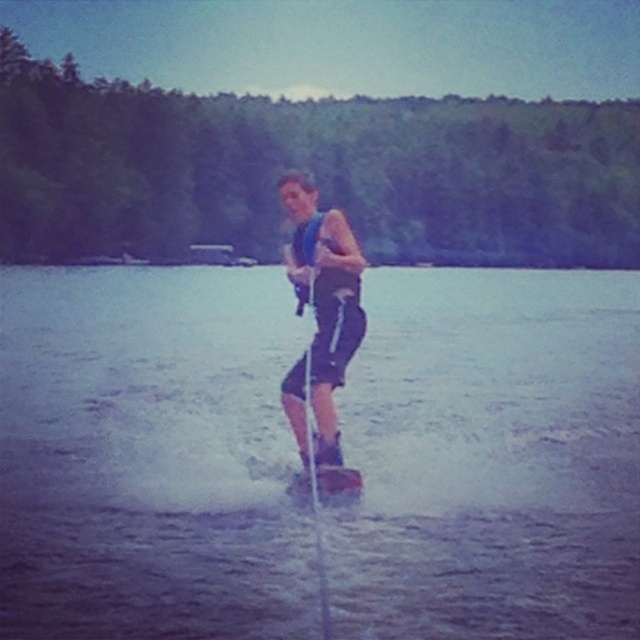
You are a photographer trying to capture the water skier. You notice the clear water at center and the blue fabric life vest at center. Which object is closer to the camera based on their positions?

The clear water at center is closer to the camera because it is positioned in front of the blue fabric life vest at center.

You are a lifeguard observing the scene. You notice the clear water at center and the blue fabric life vest at center. Which object is positioned higher from the ground?

The clear water at center is located above the blue fabric life vest at center, so the clear water at center is higher from the ground.